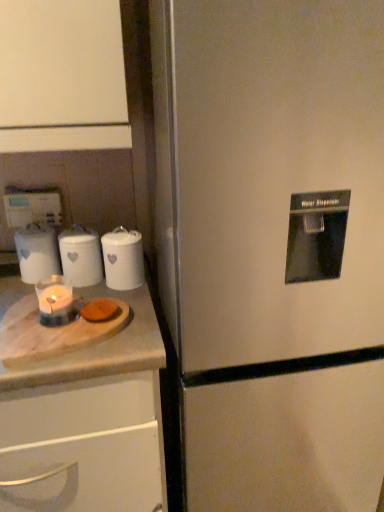
Question: Does point (114, 309) appear closer or farther from the camera than point (36, 269)?

Choices:
 (A) closer
 (B) farther

Answer: (A)

Question: Looking at their shapes, would you say brown matte cookie at lower left is wider or thinner than white glossy candle at left?

Choices:
 (A) thin
 (B) wide

Answer: (A)

Question: Which is nearer to the satin silver refrigerator at center?

Choices:
 (A) white glossy candle at left
 (B) white glossy canister at upper left, positioned as the 1th kitchen appliance in right-to-left order
 (C) white marble tray at left
 (D) white ceramic canisters at left, the 1th kitchen appliance in the left-to-right sequence
 (E) white marble cutting board at left

Answer: (E)

Question: Which of these objects is positioned farthest from the satin silver refrigerator at center?

Choices:
 (A) translucent glass candle at lower left
 (B) white marble cutting board at left
 (C) white glossy candle at left
 (D) white ceramic canisters at left, the second kitchen appliance viewed from the right
 (E) white glossy canister at upper left, placed as the second kitchen appliance when sorted from left to right

Answer: (C)